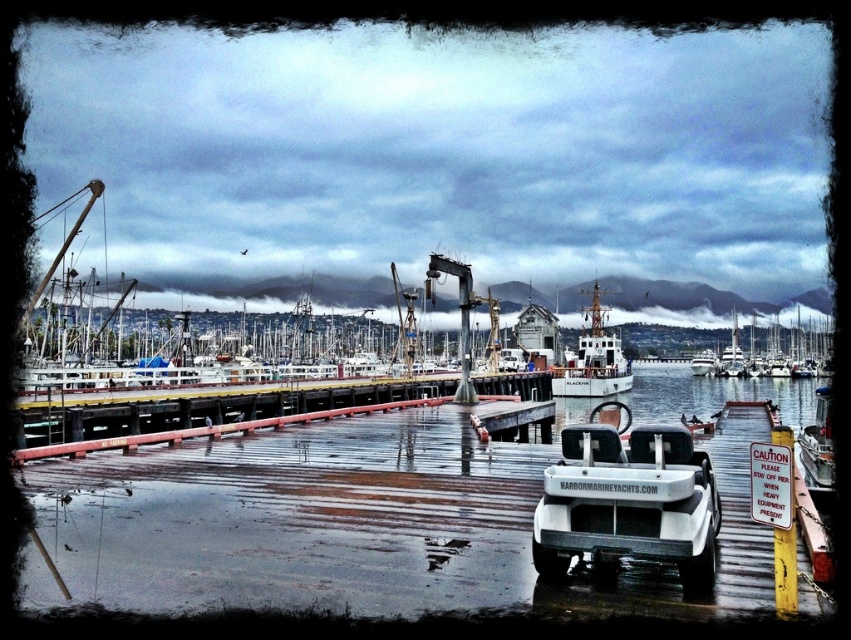
You are a delivery person standing at the edge of the dock. You need to deliver a package to the white matte golf cart at center. The golf cart is 170.90 feet away from you. Can you walk directly to the golf cart without any obstacles?

The white matte golf cart at center is 170.90 feet away from the camera, so yes, you can walk directly to the white matte golf cart at center as there are no obstacles mentioned in the scene description.

You are a delivery person needing to park your vehicle on the dock. The dock has limited space. You have a vehicle similar in size to the white matte golf cart at center. Is there enough space to park it without overlapping the white glossy sailboat at upper right?

The white matte golf cart at center occupies less space than the white glossy sailboat at upper right, so there might not be enough space to park without overlapping the white glossy sailboat at upper right.

You are standing at the edge of the dock and want to walk to the point marked by the coordinates point at point [707,564] and point at point [821,428]. Which point should you reach first to stay on the path closest to the water?

You should reach point [707,564] first because it is in front of point [821,428], meaning it is closer to you as you walk towards the water.